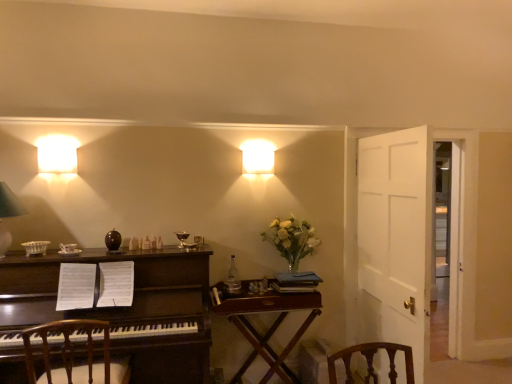
Question: Would you consider wooden chair at left to be distant from translucent glass vase at upper right?

Choices:
 (A) no
 (B) yes

Answer: (B)

Question: Can translucent glass vase at upper right be found inside wooden chair at left?

Choices:
 (A) yes
 (B) no

Answer: (B)

Question: From a real-world perspective, is wooden chair at left located beneath translucent glass vase at upper right?

Choices:
 (A) no
 (B) yes

Answer: (B)

Question: Is translucent glass vase at upper right at the back of wooden chair at left?

Choices:
 (A) yes
 (B) no

Answer: (B)

Question: Is wooden chair at left not inside translucent glass vase at upper right?

Choices:
 (A) yes
 (B) no

Answer: (A)

Question: Is wooden chair at left shorter than translucent glass vase at upper right?

Choices:
 (A) no
 (B) yes

Answer: (A)

Question: From the image's perspective, is white matte wall sconce at upper left, marked as the second lamp in a front-to-back arrangement, on top of translucent glass vase at upper right?

Choices:
 (A) yes
 (B) no

Answer: (A)

Question: From the image's perspective, is white matte wall sconce at upper left, the second lamp ordered from the bottom, under translucent glass vase at upper right?

Choices:
 (A) no
 (B) yes

Answer: (A)

Question: From a real-world perspective, is white matte wall sconce at upper left, the second lamp ordered from the bottom, under translucent glass vase at upper right?

Choices:
 (A) yes
 (B) no

Answer: (B)

Question: Are white matte wall sconce at upper left, positioned as the second lamp in left-to-right order, and translucent glass vase at upper right located far from each other?

Choices:
 (A) no
 (B) yes

Answer: (B)

Question: Is white matte wall sconce at upper left, which is counted as the 2th lamp, starting from the top, to the right of translucent glass vase at upper right from the viewer's perspective?

Choices:
 (A) no
 (B) yes

Answer: (A)

Question: Does white matte wall sconce at upper left, positioned as the second lamp in left-to-right order, contain translucent glass vase at upper right?

Choices:
 (A) no
 (B) yes

Answer: (A)

Question: Is white wooden door at right bigger than matte white square at upper center, positioned as the first lamp in top-to-bottom order?

Choices:
 (A) yes
 (B) no

Answer: (A)